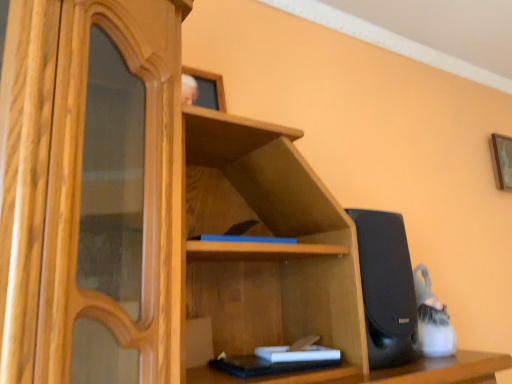
In order to face wooden picture frame at upper right, should I rotate leftwards or rightwards?

You should look right and rotate roughly 30.602 degrees.

Measure the distance between wooden picture frame at upper right and camera.

A distance of 1.90 meters exists between wooden picture frame at upper right and camera.

Find the location of a particular element. The width and height of the screenshot is (512, 384). wooden picture frame at upper right is located at coordinates (502, 160).

This screenshot has width=512, height=384. What do you see at coordinates (502, 160) in the screenshot?
I see `wooden picture frame at upper right` at bounding box center [502, 160].

What is the approximate width of white matte book at lower center?

white matte book at lower center is 6.00 inches in width.

Where is `white matte book at lower center`? The height and width of the screenshot is (384, 512). white matte book at lower center is located at coordinates (297, 354).

The width and height of the screenshot is (512, 384). What do you see at coordinates (297, 354) in the screenshot?
I see `white matte book at lower center` at bounding box center [297, 354].

Identify the location of wooden picture frame at upper right. (502, 160).

Between wooden picture frame at upper right and white matte book at lower center, which one appears on the left side from the viewer's perspective?

Positioned to the left is white matte book at lower center.

Looking at this image, is wooden picture frame at upper right further to camera compared to white matte book at lower center?

Yes.

Considering the positions of point (497, 135) and point (280, 351), is point (497, 135) closer or farther from the camera than point (280, 351)?

Point (497, 135).

From the image's perspective, is wooden picture frame at upper right under white matte book at lower center?

No, from the image's perspective, wooden picture frame at upper right is not below white matte book at lower center.

From a real-world perspective, which is physically above, wooden picture frame at upper right or white matte book at lower center?

wooden picture frame at upper right is physically above.

Consider the image. Which object is thinner, wooden picture frame at upper right or white matte book at lower center?

wooden picture frame at upper right is thinner.

Based on the photo, considering the sizes of objects wooden picture frame at upper right and white matte book at lower center in the image provided, who is taller, wooden picture frame at upper right or white matte book at lower center?

wooden picture frame at upper right.

Can you confirm if wooden picture frame at upper right is bigger than white matte book at lower center?

Correct, wooden picture frame at upper right is larger in size than white matte book at lower center.

Does wooden picture frame at upper right contain white matte book at lower center?

No, white matte book at lower center is not a part of wooden picture frame at upper right.

Is wooden picture frame at upper right not close to white matte book at lower center?

wooden picture frame at upper right is far away from white matte book at lower center.

Is wooden picture frame at upper right turned away from white matte book at lower center?

That's not correct — wooden picture frame at upper right is not looking away from white matte book at lower center.

The width and height of the screenshot is (512, 384). Identify the location of picture frame that appears above the white matte book at lower center (from a real-world perspective). (502, 160).

Is white matte book at lower center at the right side of wooden picture frame at upper right?

Incorrect, white matte book at lower center is not on the right side of wooden picture frame at upper right.

Who is more distant, white matte book at lower center or wooden picture frame at upper right?

wooden picture frame at upper right is further from the camera.

Is point (333, 352) positioned before point (504, 162)?

Yes.

From the image's perspective, is white matte book at lower center over wooden picture frame at upper right?

No, from the image's perspective, white matte book at lower center is not above wooden picture frame at upper right.

From a real-world perspective, between white matte book at lower center and wooden picture frame at upper right, who is vertically lower?

white matte book at lower center.

In the scene shown: Considering the relative sizes of white matte book at lower center and wooden picture frame at upper right in the image provided, is white matte book at lower center wider than wooden picture frame at upper right?

Yes, white matte book at lower center is wider than wooden picture frame at upper right.

Is white matte book at lower center shorter than wooden picture frame at upper right?

Yes, white matte book at lower center is shorter than wooden picture frame at upper right.

Between white matte book at lower center and wooden picture frame at upper right, which one has larger size?

With larger size is wooden picture frame at upper right.

Is white matte book at lower center outside of wooden picture frame at upper right?

Indeed, white matte book at lower center is completely outside wooden picture frame at upper right.

Is there a large distance between white matte book at lower center and wooden picture frame at upper right?

Yes, white matte book at lower center is far from wooden picture frame at upper right.

Is white matte book at lower center turned away from wooden picture frame at upper right?

No, white matte book at lower center is not facing away from wooden picture frame at upper right.

How many degrees apart are the facing directions of white matte book at lower center and wooden picture frame at upper right?

The angular difference between white matte book at lower center and wooden picture frame at upper right is 14.1 degrees.

How far apart are white matte book at lower center and wooden picture frame at upper right?

They are 4.73 feet apart.

The width and height of the screenshot is (512, 384). Find the location of `book that is under the wooden picture frame at upper right (from a real-world perspective)`. book that is under the wooden picture frame at upper right (from a real-world perspective) is located at coordinates (297, 354).

Find the location of a particular element. picture frame to the right of white matte book at lower center is located at coordinates click(502, 160).

Find the location of `picture frame located above the white matte book at lower center (from a real-world perspective)`. picture frame located above the white matte book at lower center (from a real-world perspective) is located at coordinates (502, 160).